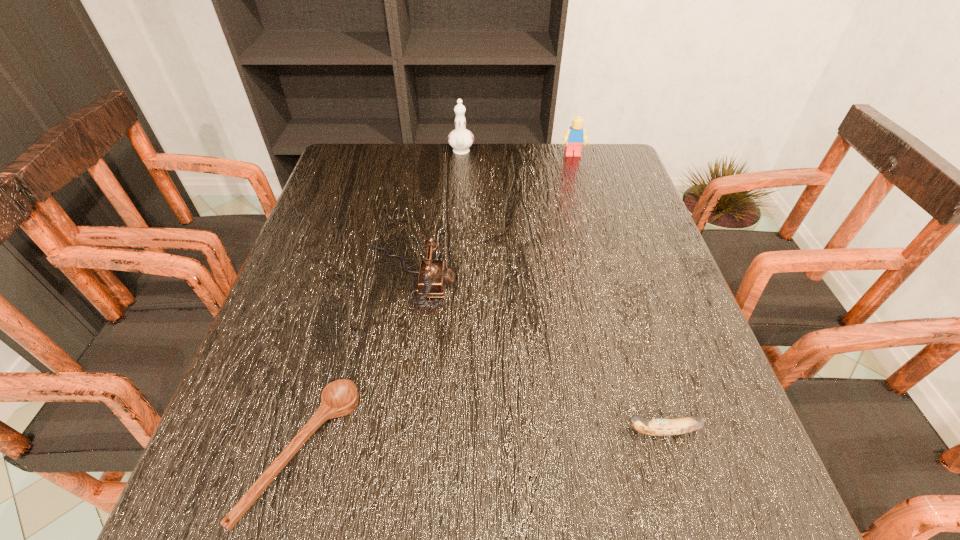
Where is `free location located 0.220m on the peel of the banana`? The width and height of the screenshot is (960, 540). free location located 0.220m on the peel of the banana is located at coordinates (491, 431).

The width and height of the screenshot is (960, 540). Find the location of `vacant area situated 0.050m on the peel of the banana`. vacant area situated 0.050m on the peel of the banana is located at coordinates (593, 431).

Locate an element on the screen. This screenshot has height=540, width=960. vacant space located 0.220m on the right of the wooden spoon is located at coordinates (488, 453).

Find the location of a particular element. Image resolution: width=960 pixels, height=540 pixels. chinaware that is at the far edge is located at coordinates (460, 139).

Find the location of a particular element. This screenshot has height=540, width=960. Lego located at the far edge is located at coordinates (575, 136).

Image resolution: width=960 pixels, height=540 pixels. I want to click on object that is at the near edge, so [x=339, y=398].

Where is `telephone situated at the left edge`? This screenshot has width=960, height=540. telephone situated at the left edge is located at coordinates (432, 279).

What are the coordinates of `wooden spoon located in the left edge section of the desktop` in the screenshot? It's located at (339, 398).

Locate an element on the screen. The width and height of the screenshot is (960, 540). Lego that is positioned at the right edge is located at coordinates (575, 136).

You are a GUI agent. You are given a task and a screenshot of the screen. Output one action in this format:
    pyautogui.click(x=<x>, y=<y>)
    Task: Click on the banana at the right edge
    The image size is (960, 540).
    Given the screenshot: What is the action you would take?
    pyautogui.click(x=654, y=427)